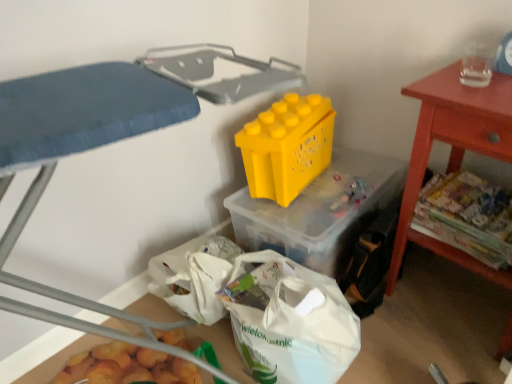
Image resolution: width=512 pixels, height=384 pixels. Find the location of `free space above printed paper magazines at right (from a real-world perspective)`. free space above printed paper magazines at right (from a real-world perspective) is located at coordinates (475, 196).